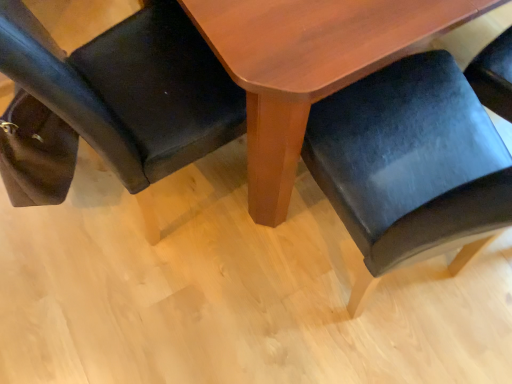
This screenshot has width=512, height=384. Identify the location of vacant space in front of velvet black chair at lower right, which is counted as the first chair, starting from the right. (373, 348).